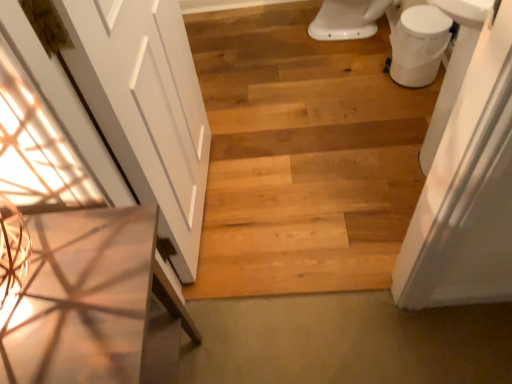
Find the location of `vacant point to the right of white matte door at left`. vacant point to the right of white matte door at left is located at coordinates (293, 190).